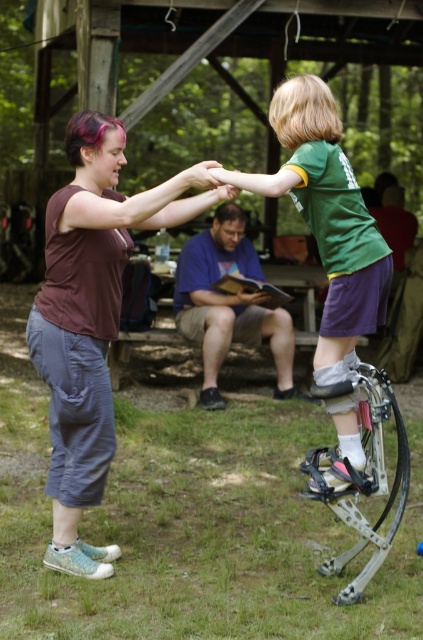
Which is above, matte brown tank top at center or green fabric shirt at upper center?

green fabric shirt at upper center is above.

Between point (76, 572) and point (359, 241), which one is positioned behind?

The point (76, 572) is more distant.

Find the location of a particular element. matte brown tank top at center is located at coordinates (91, 317).

Does green fabric shirt at upper center appear under purple cotton shirt at center?

Actually, green fabric shirt at upper center is above purple cotton shirt at center.

Which is below, green fabric shirt at upper center or purple cotton shirt at center?

Positioned lower is purple cotton shirt at center.

Describe the element at coordinates (329, 244) in the screenshot. I see `green fabric shirt at upper center` at that location.

The image size is (423, 640). I want to click on green fabric shirt at upper center, so click(329, 244).

Who is taller, matte brown tank top at center or purple cotton shirt at center?

matte brown tank top at center

Does point (93, 497) come behind point (211, 236)?

No, it is in front of (211, 236).

I want to click on matte brown tank top at center, so [x=91, y=317].

The image size is (423, 640). Identify the location of matte brown tank top at center. (91, 317).